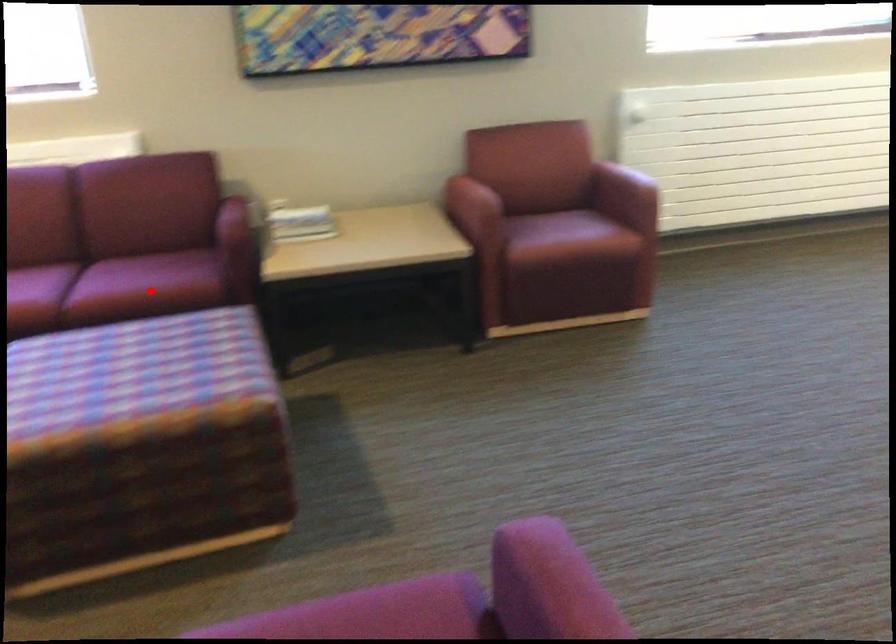
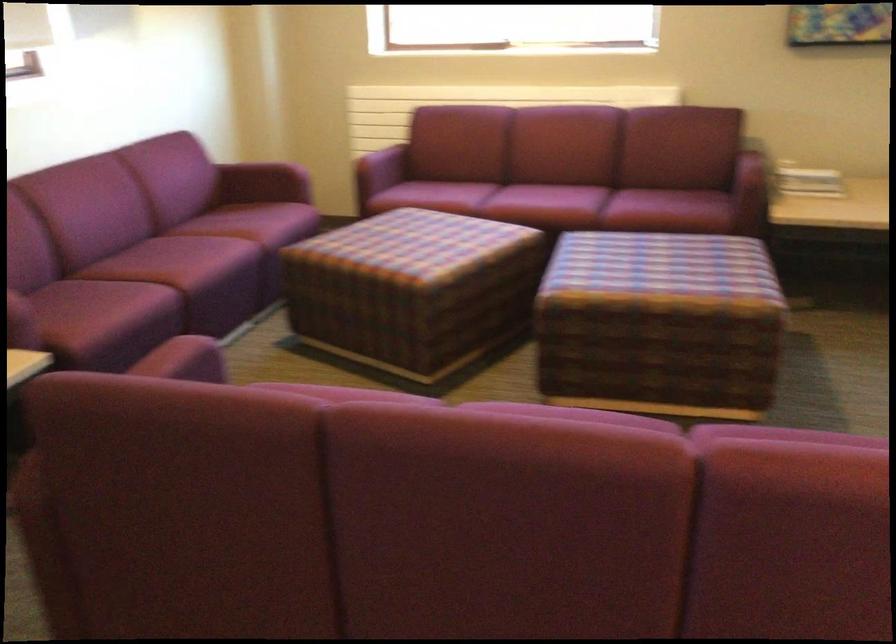
Question: I am providing you with two images of the same scene from different viewpoints. A red point is shown in image1. For the corresponding object point in image2, is it positioned nearer or farther from the camera?

Choices:
 (A) Nearer
 (B) Farther

Answer: (B)